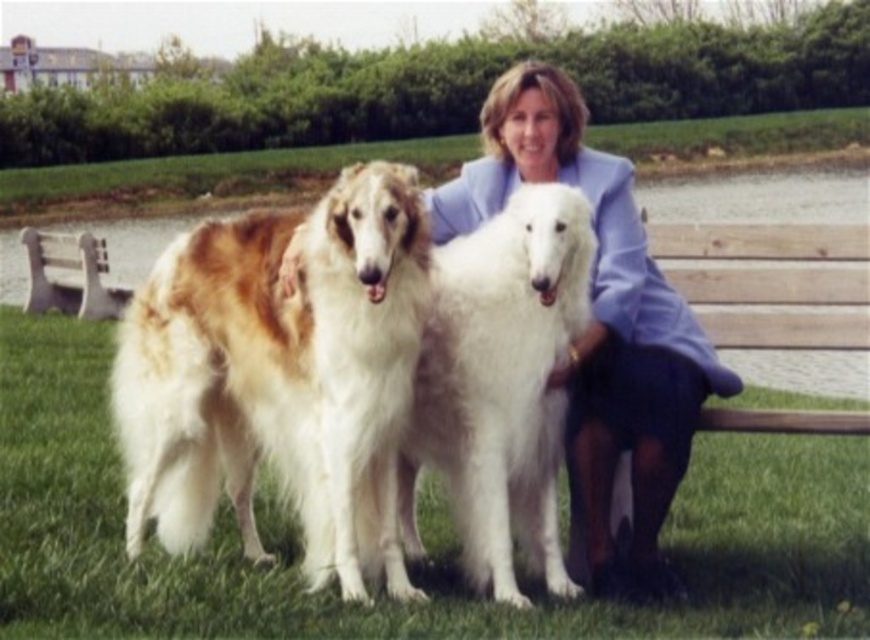
Question: Which point appears closest to the camera in this image?

Choices:
 (A) (318, 236)
 (B) (599, 433)
 (C) (480, 548)

Answer: (A)

Question: From the image, what is the correct spatial relationship of light blue fabric at center in relation to white fluffy dog at center?

Choices:
 (A) below
 (B) above

Answer: (B)

Question: Can you confirm if golden fur dog at center is positioned to the left of white wood bench at left?

Choices:
 (A) no
 (B) yes

Answer: (A)

Question: Estimate the real-world distances between objects in this image. Which object is farther from the white fluffy dog at center?

Choices:
 (A) light blue fabric at center
 (B) golden fur dog at center

Answer: (B)

Question: Can you confirm if light blue fabric at center is positioned below white wood bench at left?

Choices:
 (A) no
 (B) yes

Answer: (B)

Question: Which of the following is the farthest from the observer?

Choices:
 (A) (470, 246)
 (B) (304, 268)
 (C) (713, 387)

Answer: (C)